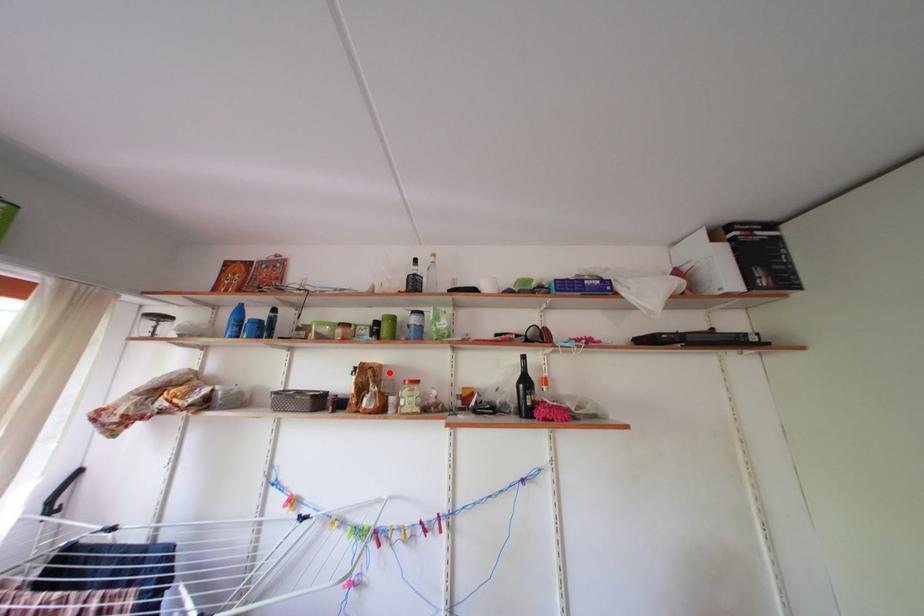
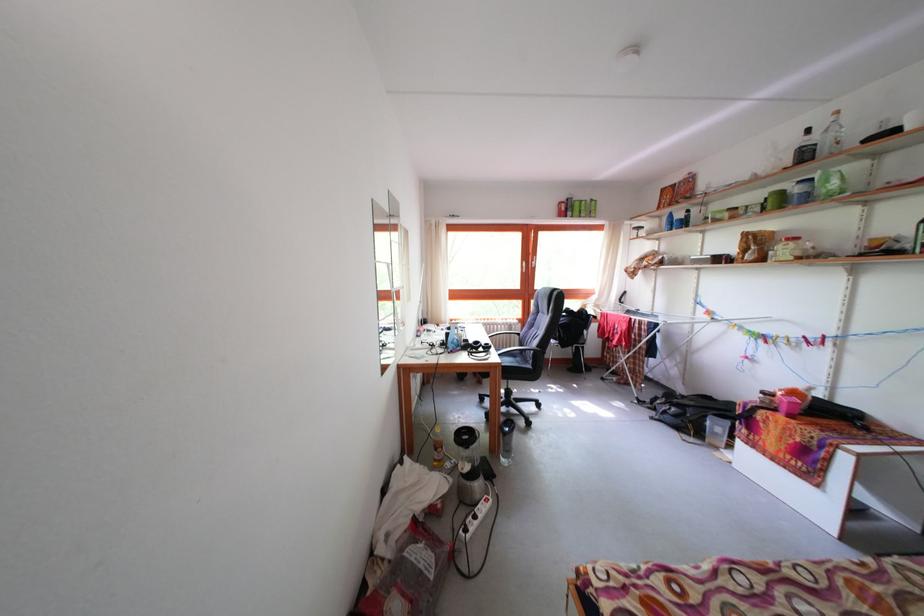
The point at the highlighted location is marked in the first image. Where is the corresponding point in the second image?

(783, 238)